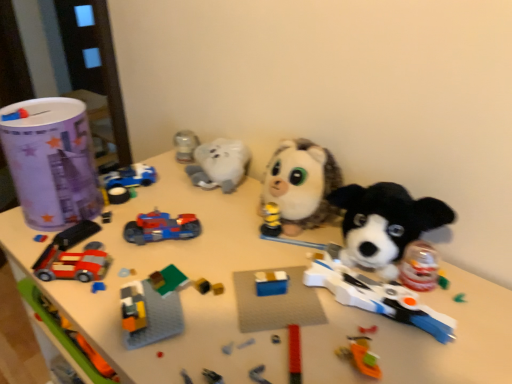
Question: Based on their positions, is fluffy white plush at center, acting as the 1th toy starting from the right, located to the left or right of shiny plastic toy car at center, the fourth toy positioned from the left?

Choices:
 (A) right
 (B) left

Answer: (A)

Question: From the image's perspective, relative to shiny plastic toy car at center, which is counted as the second toy, starting from the right, is fluffy white plush at center, acting as the 1th toy starting from the right, above or below?

Choices:
 (A) above
 (B) below

Answer: (A)

Question: Based on their relative distances, which object is nearer to the blue plastic car at upper left, positioned as the 3th toy in left-to-right order?

Choices:
 (A) paper cup at left, the 1th toy viewed from the left
 (B) brick-like plastic car at lower left, the 2th toy in the left-to-right sequence
 (C) fluffy white plush at center, acting as the 1th toy starting from the right
 (D) shiny plastic toy car at center, which is counted as the second toy, starting from the right
 (E) white matte table at center

Answer: (A)

Question: Which object is the closest to the shiny plastic toy car at center, the fourth toy positioned from the left?

Choices:
 (A) fluffy white plush at center, acting as the 1th toy starting from the right
 (B) brick-like plastic car at lower left, arranged as the 4th toy when viewed from the right
 (C) paper cup at left, marked as the fifth toy in a right-to-left arrangement
 (D) white matte table at center
 (E) blue plastic car at upper left, positioned as the third toy in right-to-left order

Answer: (B)